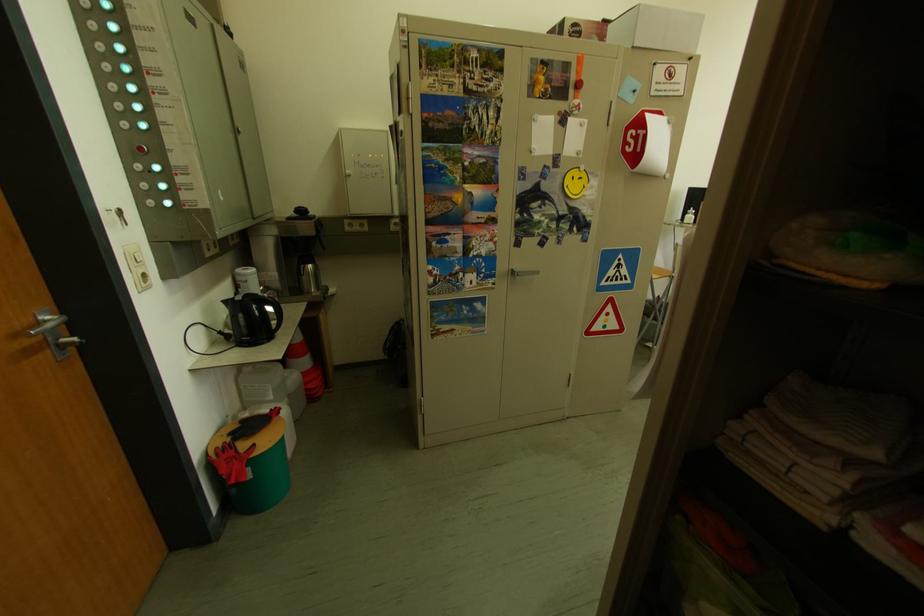
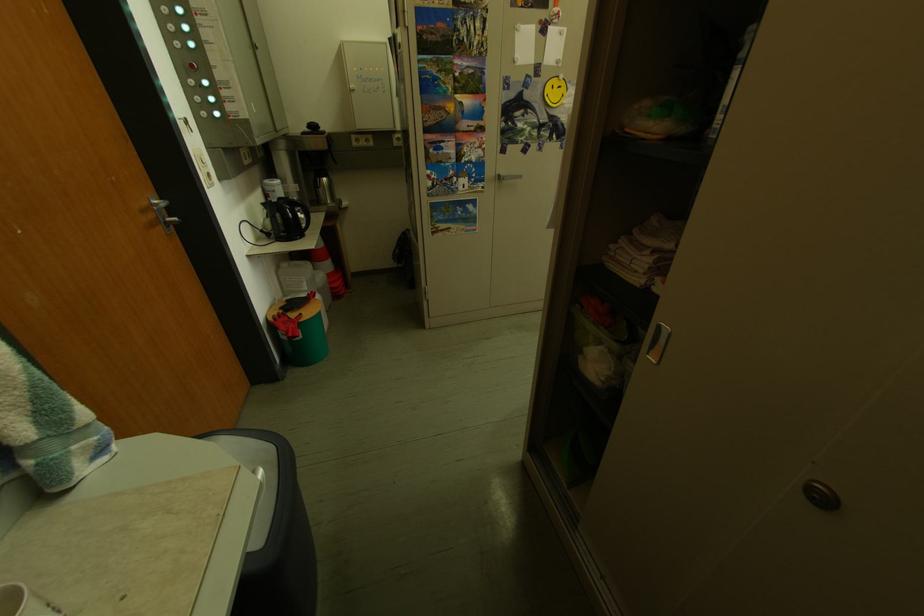
Where in the second image is the point corresponding to point (59, 320) from the first image?

(168, 205)